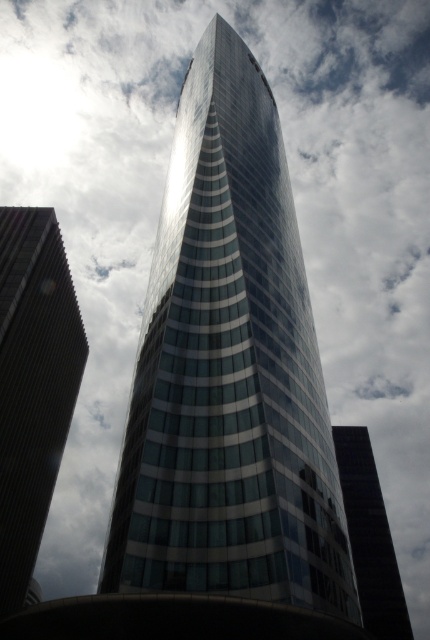
Is matte glass skyscraper at left wider than glassy reflective skyscraper at center?

No.

Describe the element at coordinates (33, 385) in the screenshot. I see `matte glass skyscraper at left` at that location.

Which is behind, point (18, 454) or point (380, 573)?

The point (380, 573) is behind.

Locate an element on the screen. The width and height of the screenshot is (430, 640). matte glass skyscraper at left is located at coordinates (33, 385).